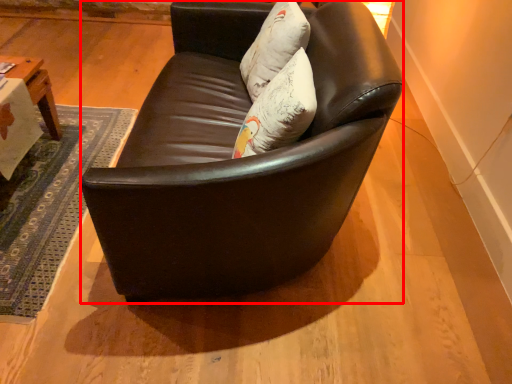
Question: In this image, where is studio couch (annotated by the red box) located relative to pillow?

Choices:
 (A) left
 (B) right

Answer: (A)